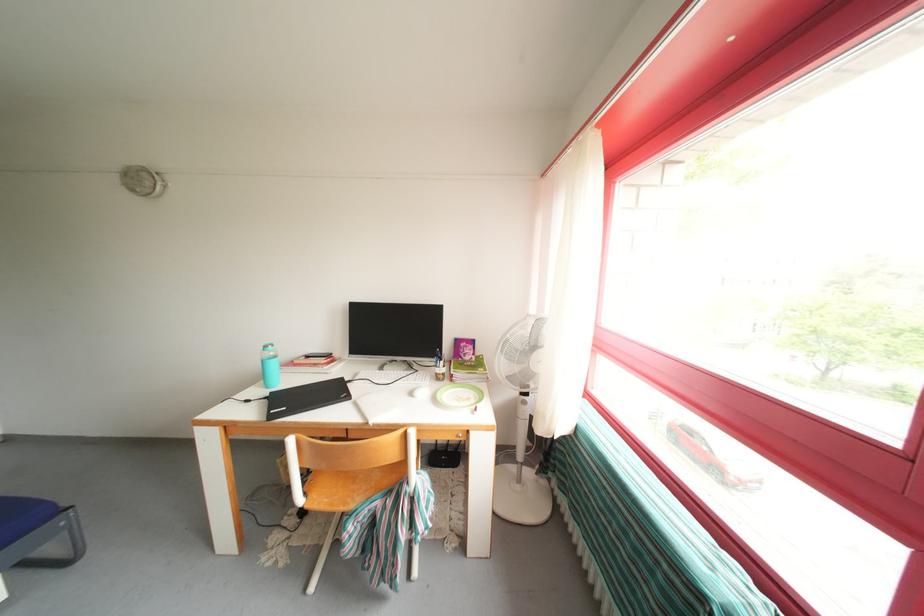
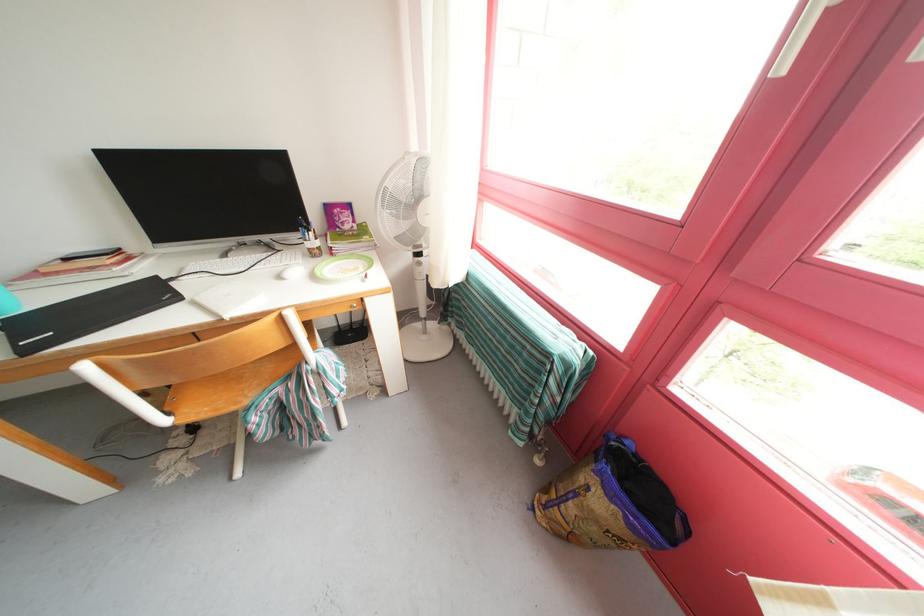
Locate, in the second image, the point that corresponds to the point at 419,386 in the first image.

(284, 267)